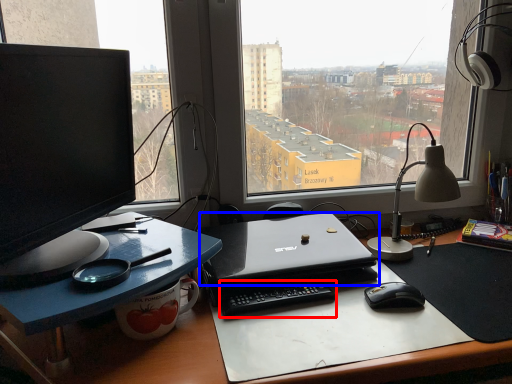
Question: Which point is closer to the camera, laptop keyboard (highlighted by a red box) or laptop (highlighted by a blue box)?

Choices:
 (A) laptop keyboard
 (B) laptop

Answer: (B)